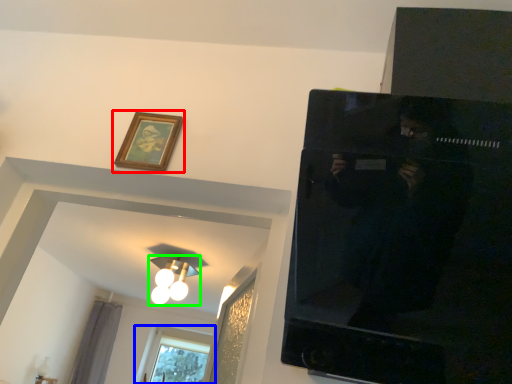
Question: Considering the real-world distances, which object is farthest from picture frame (highlighted by a red box)? window (highlighted by a blue box) or light fixture (highlighted by a green box)?

Choices:
 (A) window
 (B) light fixture

Answer: (A)